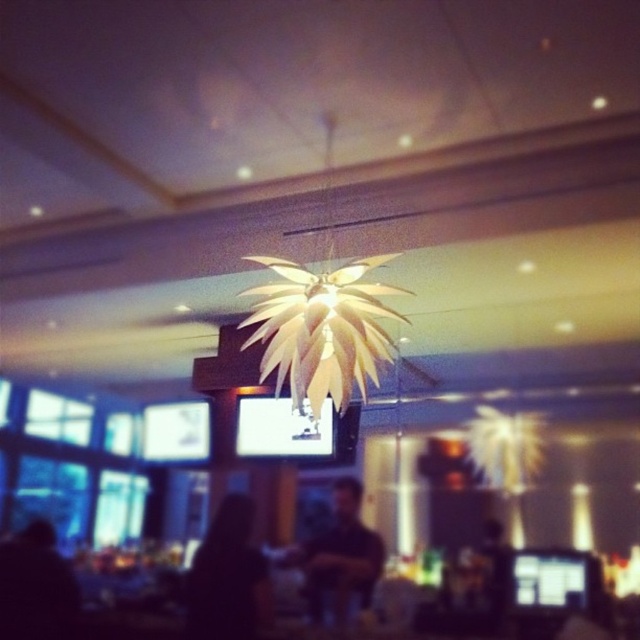
You are a customer entering the restaurant and see the matte gold leaf chandelier at center and the black matte person at lower center. Which object is larger in size?

The matte gold leaf chandelier at center is bigger than the black matte person at lower center according to the description.

Based on the photo, you are a server in a restaurant and need to deliver a drink to the black matte person at lower center and the black matte person at lower left. Which person should you approach first to ensure you donot block the view of the other person?

You should approach the black matte person at lower center first because they are in front of the black matte person at lower left, so serving them first will avoid blocking the view of the person behind.

You are a customer sitting at a table in this restaurant. You notice the matte gold leaf chandelier at center and the black matte person at lower left. Which object is directly above you?

The matte gold leaf chandelier at center is positioned over the black matte person at lower left, so the matte gold leaf chandelier at center is directly above the black matte person at lower left.